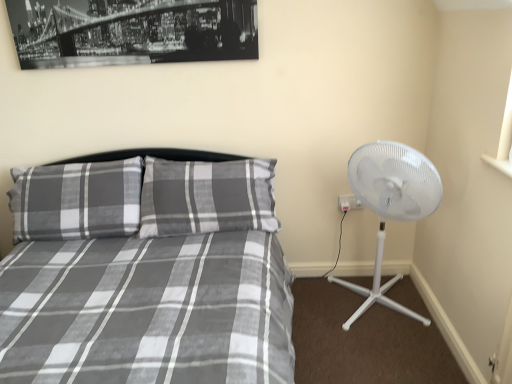
Question: Is plaid fabric pillow at left smaller than white plastic fan at right?

Choices:
 (A) yes
 (B) no

Answer: (A)

Question: Is plaid fabric pillow at left outside of white plastic fan at right?

Choices:
 (A) yes
 (B) no

Answer: (A)

Question: From a real-world perspective, is plaid fabric pillow at left positioned under white plastic fan at right based on gravity?

Choices:
 (A) yes
 (B) no

Answer: (B)

Question: Is plaid fabric pillow at left facing towards white plastic fan at right?

Choices:
 (A) yes
 (B) no

Answer: (B)

Question: Is plaid fabric pillow at left positioned in front of white plastic fan at right?

Choices:
 (A) yes
 (B) no

Answer: (B)

Question: In terms of size, does black matte print at upper center appear bigger or smaller than white plastic fan at right?

Choices:
 (A) small
 (B) big

Answer: (A)

Question: From the image's perspective, is black matte print at upper center above or below white plastic fan at right?

Choices:
 (A) above
 (B) below

Answer: (A)

Question: From a real-world perspective, is black matte print at upper center above or below white plastic fan at right?

Choices:
 (A) below
 (B) above

Answer: (B)

Question: Visually, is black matte print at upper center positioned to the left or to the right of white plastic fan at right?

Choices:
 (A) left
 (B) right

Answer: (A)

Question: In terms of height, does white plastic electric outlet at right look taller or shorter compared to plaid fabric pillow at left?

Choices:
 (A) short
 (B) tall

Answer: (A)

Question: From the image's perspective, is white plastic electric outlet at right located above or below plaid fabric pillow at left?

Choices:
 (A) below
 (B) above

Answer: (A)

Question: Does point (356, 205) appear closer or farther from the camera than point (95, 210)?

Choices:
 (A) closer
 (B) farther

Answer: (B)

Question: In terms of width, does white plastic electric outlet at right look wider or thinner when compared to plaid fabric pillow at left?

Choices:
 (A) thin
 (B) wide

Answer: (A)

Question: From their relative heights in the image, would you say gray plaid bed at center is taller or shorter than white plastic electric outlet at right?

Choices:
 (A) tall
 (B) short

Answer: (A)

Question: Based on their positions, is gray plaid bed at center located to the left or right of white plastic electric outlet at right?

Choices:
 (A) right
 (B) left

Answer: (B)